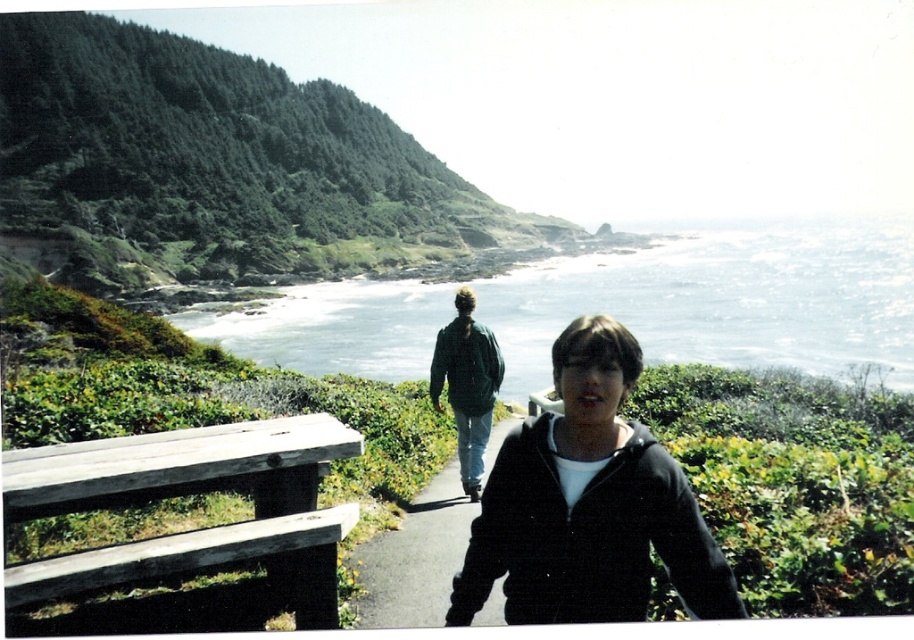
You are a photographer standing at the end of the coastal path. You want to take a photo that includes both the clear blue water at center and the black matte jacket at center. Since you can only focus on one subject, which one will appear larger in your photo?

The clear blue water at center will appear larger in the photo because it has a greater height compared to the black matte jacket at center.

You are a photographer standing at the start of the coastal path. You want to take a photo that includes both the black matte jacket at center and the green matte jacket at center. Given that your camera has a maximum focus range of 20 feet, will you be able to capture both subjects in focus?

The black matte jacket at center and green matte jacket at center are 18.86 feet apart from each other. Since the distance between them is within the camera maximum focus range of 20 feet, both subjects can be captured in focus.

You are standing on the coastal path and see the clear blue water at center and the black matte jacket at center. Which object takes up more space in the image?

The clear blue water at center takes up more space in the image than the black matte jacket at center because it is bigger.